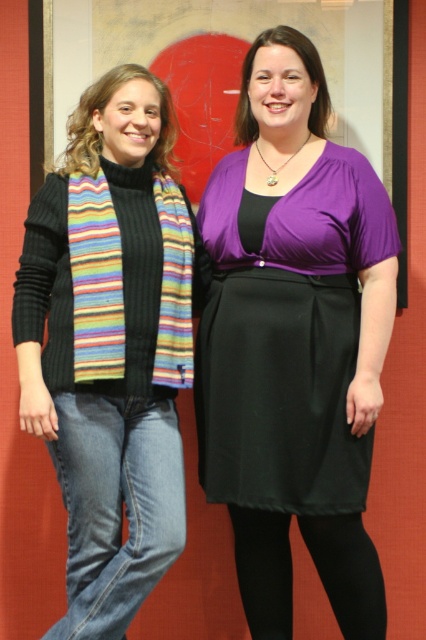
Question: Does striped knit scarf at left have a greater width compared to black tights at lower center?

Choices:
 (A) no
 (B) yes

Answer: (B)

Question: Which point is farther to the camera?

Choices:
 (A) (232, 464)
 (B) (111, 490)
 (C) (109, 627)

Answer: (A)

Question: Which of the following is the closest to the observer?

Choices:
 (A) purple satin dress at center
 (B) black tights at lower center
 (C) striped knit scarf at left

Answer: (C)

Question: Which object is closer to the camera taking this photo?

Choices:
 (A) striped knit scarf at left
 (B) purple satin dress at center
 (C) denim jeans at lower left
 (D) black tights at lower center

Answer: (A)

Question: From the image, what is the correct spatial relationship of striped knit scarf at left in relation to denim jeans at lower left?

Choices:
 (A) above
 (B) below

Answer: (A)

Question: Is denim jeans at lower left further to the viewer compared to black tights at lower center?

Choices:
 (A) yes
 (B) no

Answer: (B)